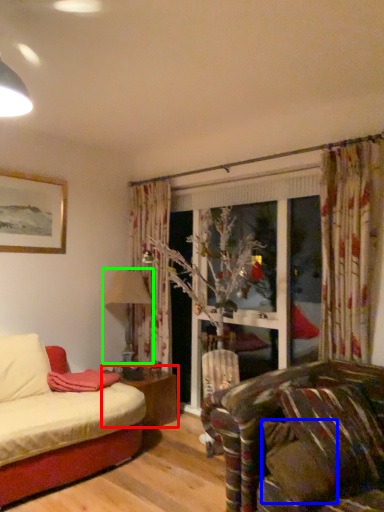
Question: Which object is the farthest from table (highlighted by a red box)? Choose among these: pillow (highlighted by a blue box) or lamp (highlighted by a green box).

Choices:
 (A) pillow
 (B) lamp

Answer: (A)